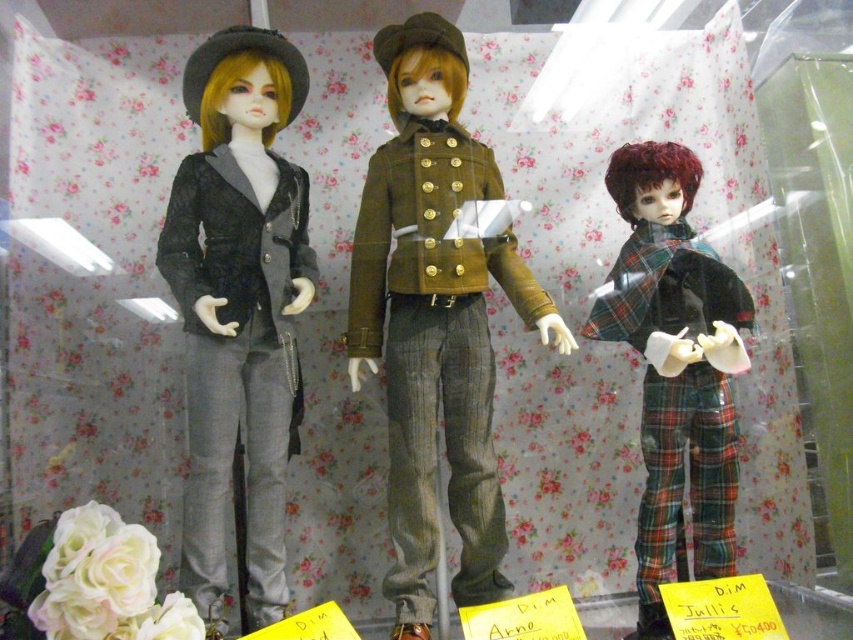
Question: Among these objects, which one is nearest to the camera?

Choices:
 (A) matte black jacket at left
 (B) matte brown jacket at center

Answer: (A)

Question: Can you confirm if matte brown jacket at center is positioned above matte black jacket at left?

Choices:
 (A) no
 (B) yes

Answer: (B)

Question: Does matte black jacket at left have a lesser width compared to plaid fabric pantsuit at right?

Choices:
 (A) yes
 (B) no

Answer: (A)

Question: Which of these objects is positioned closest to the plaid fabric pantsuit at right?

Choices:
 (A) matte black jacket at left
 (B) matte brown jacket at center

Answer: (B)

Question: Is matte black jacket at left smaller than plaid fabric pantsuit at right?

Choices:
 (A) no
 (B) yes

Answer: (A)

Question: Which point is farther to the camera?

Choices:
 (A) matte black jacket at left
 (B) plaid fabric pantsuit at right

Answer: (B)